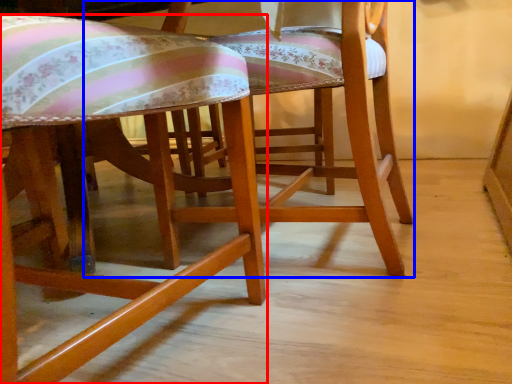
Question: Which object appears farthest to the camera in this image, chair (highlighted by a red box) or chair (highlighted by a blue box)?

Choices:
 (A) chair
 (B) chair

Answer: (B)